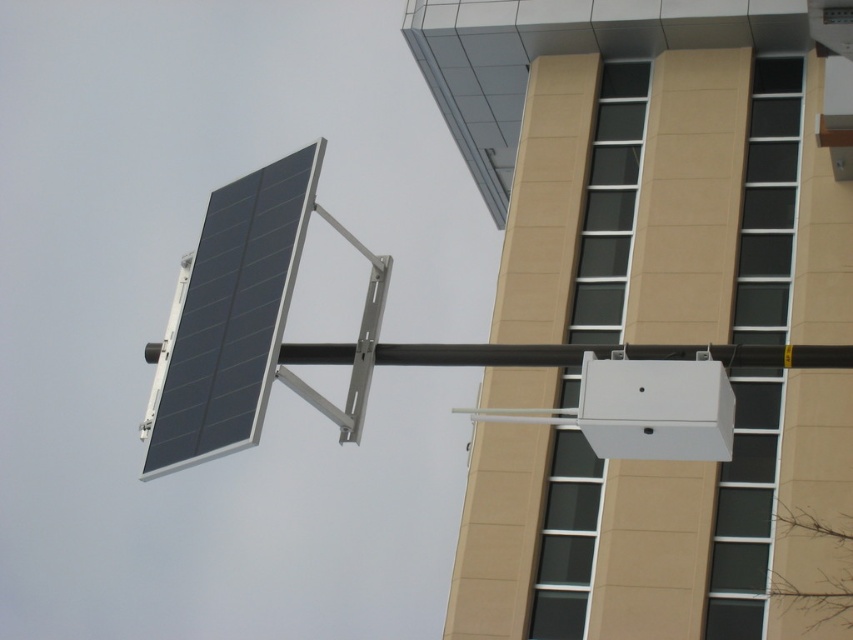
Which is more to the right, black matte solar panel at upper left or black matte pole at center?

From the viewer's perspective, black matte pole at center appears more on the right side.

Can you confirm if black matte solar panel at upper left is bigger than black matte pole at center?

Correct, black matte solar panel at upper left is larger in size than black matte pole at center.

You are a GUI agent. You are given a task and a screenshot of the screen. Output one action in this format:
    pyautogui.click(x=<x>, y=<y>)
    Task: Click on the black matte solar panel at upper left
    
    Given the screenshot: What is the action you would take?
    pyautogui.click(x=233, y=314)

I want to click on black matte solar panel at upper left, so tap(233, 314).